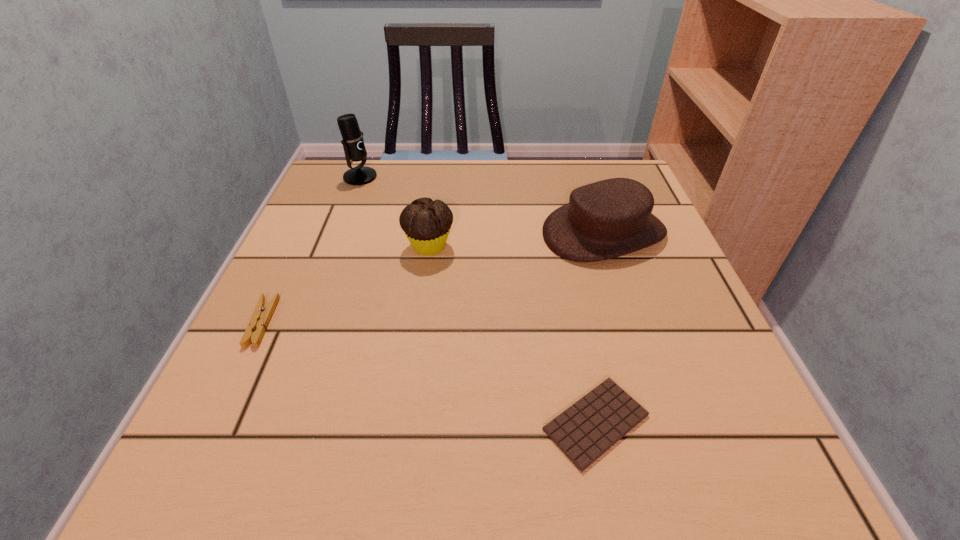
The height and width of the screenshot is (540, 960). What are the coordinates of `free point between the shortest object and the hat` in the screenshot? It's located at (600, 327).

Identify the location of free area in between the hat and the shortest object. pyautogui.click(x=600, y=327).

Locate an element on the screen. This screenshot has width=960, height=540. free spot between the hat and the third object from left to right is located at coordinates (516, 239).

I want to click on free spot between the second object from left to right and the hat, so click(482, 205).

Find the location of a particular element. free spot between the hat and the leftmost object is located at coordinates (433, 277).

At what (x,y) coordinates should I click in order to perform the action: click on free spot between the hat and the nearest object. Please return your answer as a coordinate pair (x, y). This screenshot has width=960, height=540. Looking at the image, I should click on (600, 327).

I want to click on empty location between the fourth farthest object and the chocolate bar, so click(429, 372).

In order to click on unoccupied position between the fourth object from right to left and the hat in this screenshot , I will do `click(482, 205)`.

Find the location of a particular element. This screenshot has width=960, height=540. empty space between the fourth farthest object and the hat is located at coordinates (433, 277).

Locate an element on the screen. vacant point located between the tallest object and the fourth tallest object is located at coordinates (311, 249).